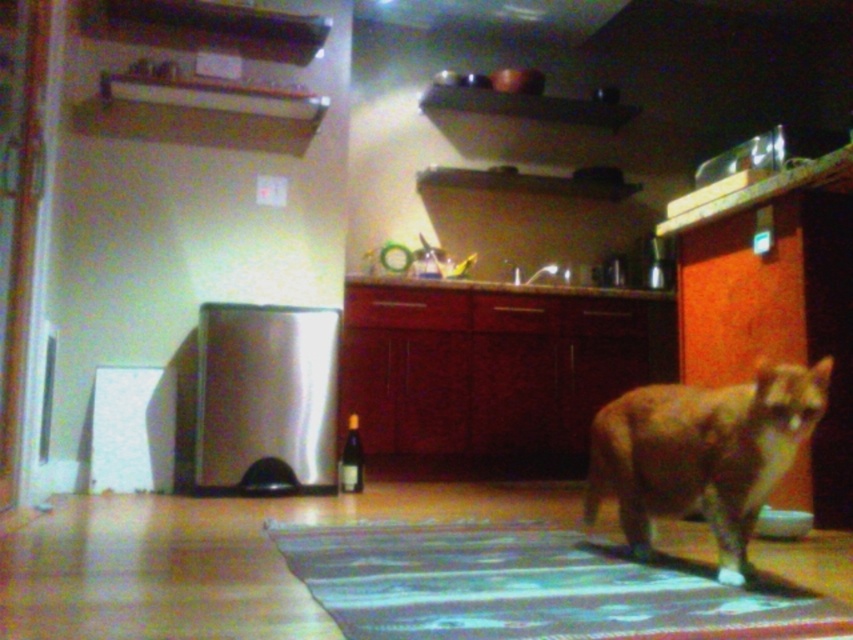
Between point (793, 634) and point (639, 413), which one is positioned in front?

Positioned in front is point (793, 634).

Does blue textured rug at center appear on the left side of orange fur cat at center?

Yes, blue textured rug at center is to the left of orange fur cat at center.

Which is behind, point (341, 589) or point (761, 374)?

The point (761, 374) is behind.

Locate an element on the screen. The width and height of the screenshot is (853, 640). blue textured rug at center is located at coordinates (531, 586).